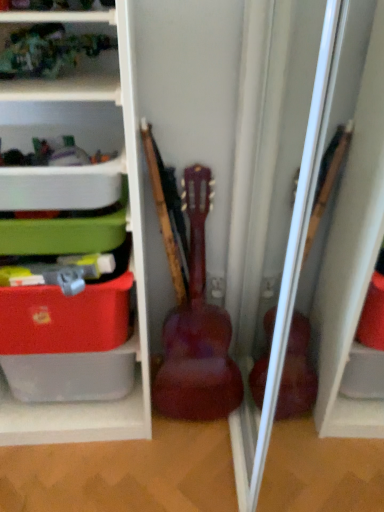
Question: Does matte plastic storage at left, marked as the 2th shelf in a top-to-bottom arrangement, come in front of matte plastic storage box at left?

Choices:
 (A) no
 (B) yes

Answer: (B)

Question: Considering the relative sizes of matte plastic storage at left, the 1th shelf positioned from the bottom, and matte plastic storage box at left in the image provided, is matte plastic storage at left, the 1th shelf positioned from the bottom, thinner than matte plastic storage box at left?

Choices:
 (A) yes
 (B) no

Answer: (B)

Question: From a real-world perspective, is matte plastic storage at left, the 1th shelf positioned from the bottom, located higher than matte plastic storage box at left?

Choices:
 (A) yes
 (B) no

Answer: (A)

Question: Can you confirm if matte plastic storage at left, marked as the 2th shelf in a top-to-bottom arrangement, is shorter than matte plastic storage box at left?

Choices:
 (A) no
 (B) yes

Answer: (A)

Question: Is matte plastic storage at left, the 1th shelf positioned from the bottom, located outside matte plastic storage box at left?

Choices:
 (A) yes
 (B) no

Answer: (A)

Question: Considering the relative sizes of matte plastic storage at left, marked as the 2th shelf in a top-to-bottom arrangement, and matte plastic storage box at left in the image provided, is matte plastic storage at left, marked as the 2th shelf in a top-to-bottom arrangement, wider than matte plastic storage box at left?

Choices:
 (A) yes
 (B) no

Answer: (A)

Question: Considering the relative sizes of white plastic container at upper left, the first shelf from the top, and matte plastic storage at left, the 1th shelf positioned from the bottom, in the image provided, is white plastic container at upper left, the first shelf from the top, wider than matte plastic storage at left, the 1th shelf positioned from the bottom,?

Choices:
 (A) yes
 (B) no

Answer: (B)

Question: Considering the relative sizes of white plastic container at upper left, the 2th shelf ordered from the bottom, and matte plastic storage at left, the 1th shelf positioned from the bottom, in the image provided, is white plastic container at upper left, the 2th shelf ordered from the bottom, smaller than matte plastic storage at left, the 1th shelf positioned from the bottom,?

Choices:
 (A) no
 (B) yes

Answer: (B)

Question: From a real-world perspective, is white plastic container at upper left, the 2th shelf ordered from the bottom, located beneath matte plastic storage at left, marked as the 2th shelf in a top-to-bottom arrangement?

Choices:
 (A) no
 (B) yes

Answer: (A)

Question: Can we say white plastic container at upper left, the 2th shelf ordered from the bottom, lies outside matte plastic storage at left, the 1th shelf positioned from the bottom?

Choices:
 (A) yes
 (B) no

Answer: (B)

Question: Is white plastic container at upper left, the 2th shelf ordered from the bottom, oriented away from matte plastic storage at left, the 1th shelf positioned from the bottom?

Choices:
 (A) no
 (B) yes

Answer: (B)

Question: Would you say matte plastic storage at left, marked as the 2th shelf in a top-to-bottom arrangement, is part of white plastic container at upper left, the 2th shelf ordered from the bottom,'s contents?

Choices:
 (A) yes
 (B) no

Answer: (B)

Question: Does matte plastic storage box at left have a smaller size compared to glossy wood guitar at center?

Choices:
 (A) no
 (B) yes

Answer: (B)